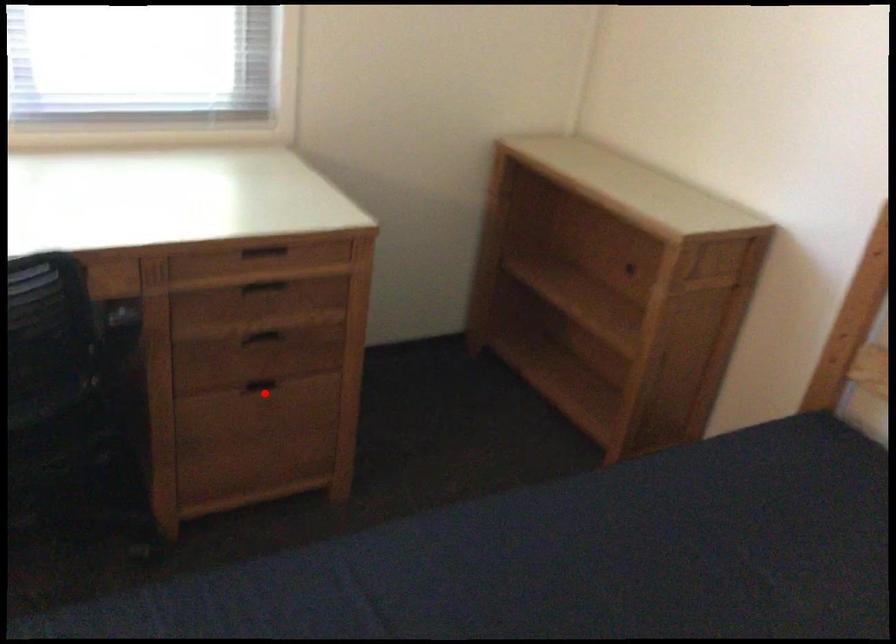
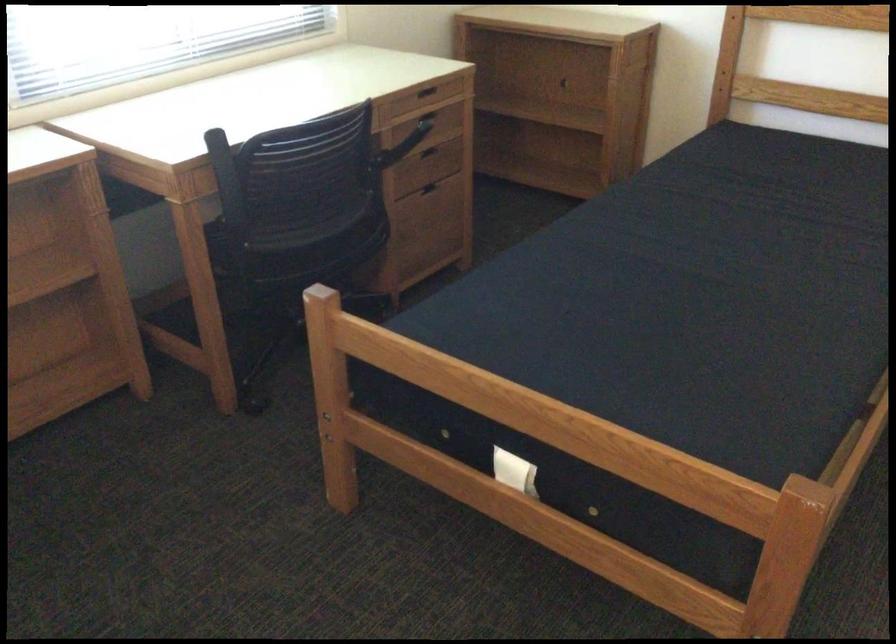
In the second image, find the point that corresponds to the highlighted location in the first image.

(434, 192)